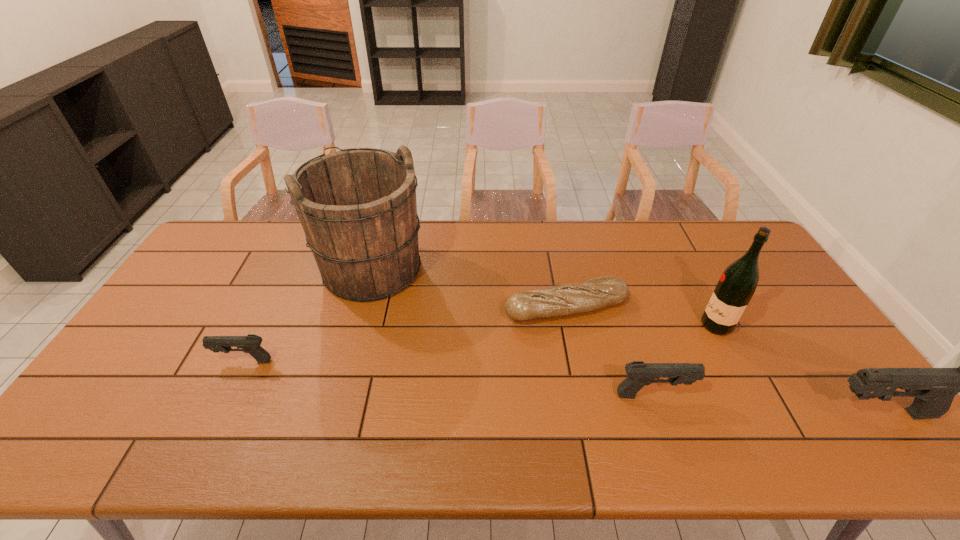
To make them evenly spaced by inserting another pistol among them, please locate a free space for this new pistol. Please provide its 2D coordinates. Your answer should be formatted as a tuple, i.e. [(x, y)], where the tuple contains the x and y coordinates of a point satisfying the conditions above.

[(442, 377)]